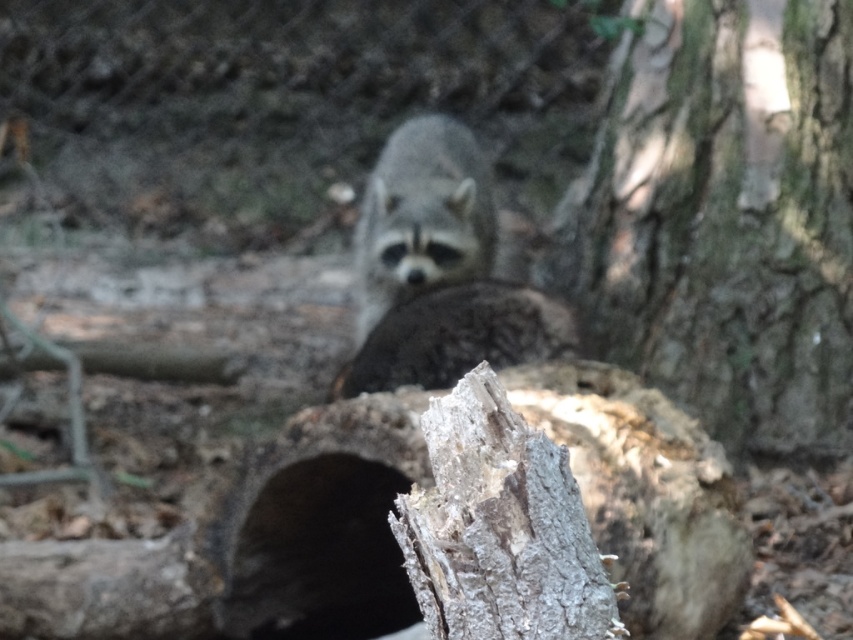
Question: Which point is closer to the camera taking this photo?

Choices:
 (A) (683, 52)
 (B) (397, 564)

Answer: (B)

Question: Among these objects, which one is farthest from the camera?

Choices:
 (A) black matte hole at center
 (B) rough bark tree at center right
 (C) fuzzy gray raccoon at center

Answer: (C)

Question: Can you confirm if black matte hole at center is wider than fuzzy gray raccoon at center?

Choices:
 (A) yes
 (B) no

Answer: (B)

Question: Which object is the farthest from the rough bark tree at center right?

Choices:
 (A) black matte hole at center
 (B) fuzzy gray raccoon at center

Answer: (A)

Question: Can you confirm if rough bark tree at center right is bigger than black matte hole at center?

Choices:
 (A) yes
 (B) no

Answer: (A)

Question: In this image, where is rough bark tree at center right located relative to fuzzy gray raccoon at center?

Choices:
 (A) above
 (B) below

Answer: (A)